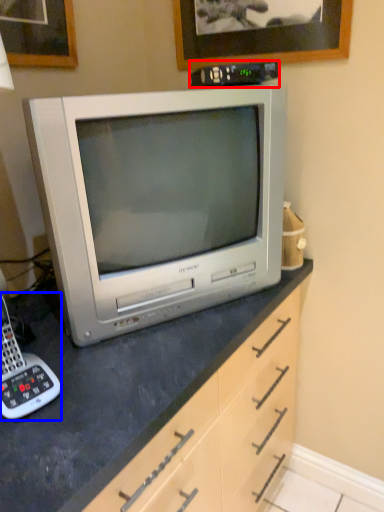
Question: Which object appears closest to the camera in this image, appliance (highlighted by a red box) or corded phone (highlighted by a blue box)?

Choices:
 (A) appliance
 (B) corded phone

Answer: (B)